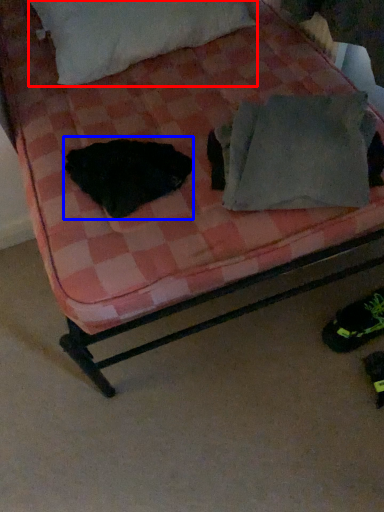
Question: Among these objects, which one is nearest to the camera, pillow (highlighted by a red box) or animal (highlighted by a blue box)?

Choices:
 (A) pillow
 (B) animal

Answer: (B)